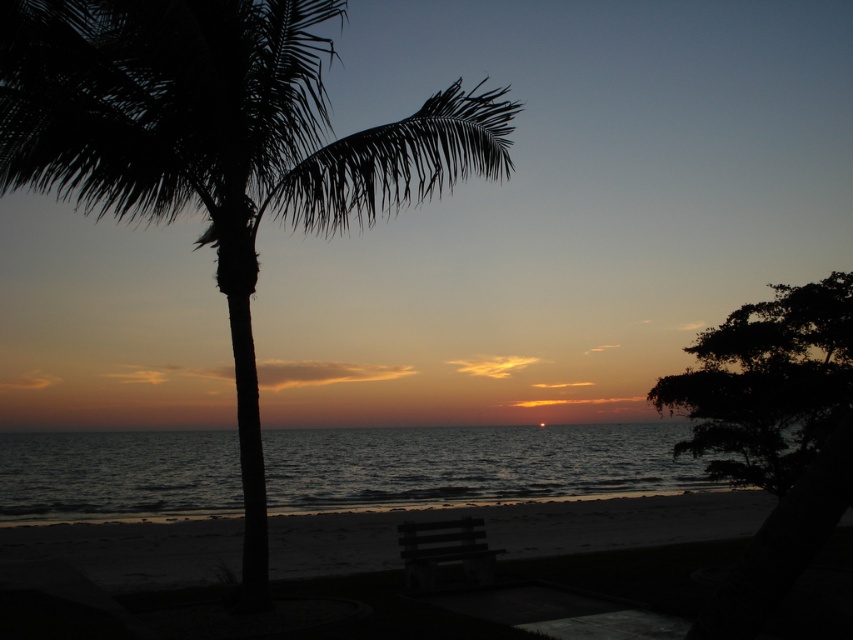
You are a photographer wanting to capture the dark green leafy tree at right and the dark wood bench at lower center in the same frame. Which object will appear bigger in your photo?

The dark green leafy tree at right will appear bigger in the photo because it is larger in size than the dark wood bench at lower center.

You are standing at the center of the beach and want to walk towards the dark green leafy tree at right. Which direction should you face to head directly towards it?

The dark green leafy tree at right is located at point 0.600 on the x axis and 0.900 on the y axis. Since you are at the center, you should face towards the right side of the beach to walk directly towards the dark green leafy tree at right.